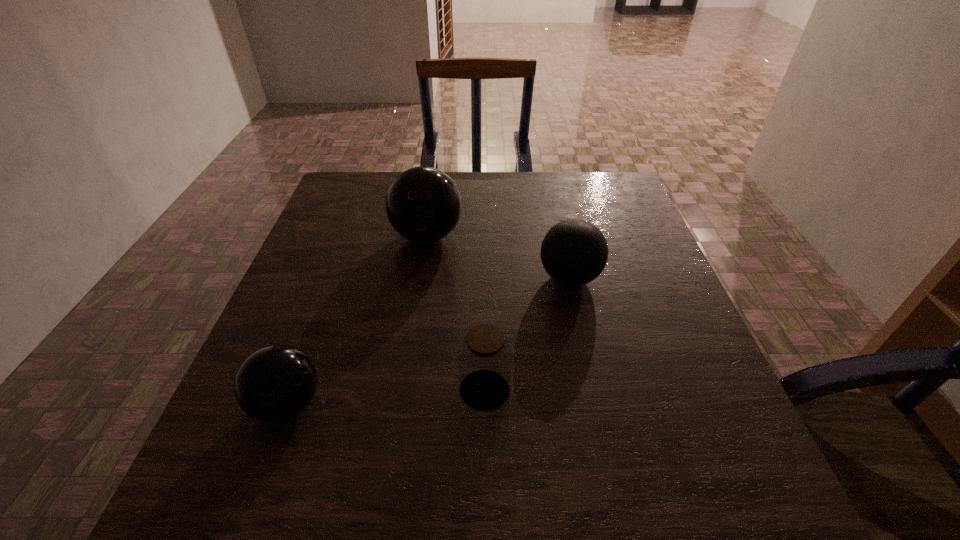
Locate an element on the screen. This screenshot has height=540, width=960. free spot located on the left of the jar is located at coordinates (275, 390).

Identify the location of free spot located on the side of the shortest bowling ball with the finger holes. (486, 403).

This screenshot has height=540, width=960. Find the location of `object situated at the left edge`. object situated at the left edge is located at coordinates pos(275,383).

The width and height of the screenshot is (960, 540). I want to click on object situated at the right edge, so click(x=574, y=252).

Where is `vacant space at the far edge of the desktop`? Image resolution: width=960 pixels, height=540 pixels. vacant space at the far edge of the desktop is located at coordinates (542, 190).

Locate an element on the screen. This screenshot has height=540, width=960. vacant space at the left edge of the desktop is located at coordinates (336, 267).

In order to click on vacant space at the right edge of the desktop in this screenshot , I will do `click(594, 223)`.

Locate an element on the screen. Image resolution: width=960 pixels, height=540 pixels. free space at the far left corner of the desktop is located at coordinates (386, 178).

This screenshot has height=540, width=960. Identify the location of vacant space at the near left corner of the desktop. (251, 474).

Locate an element on the screen. vacant space at the far right corner of the desktop is located at coordinates (603, 192).